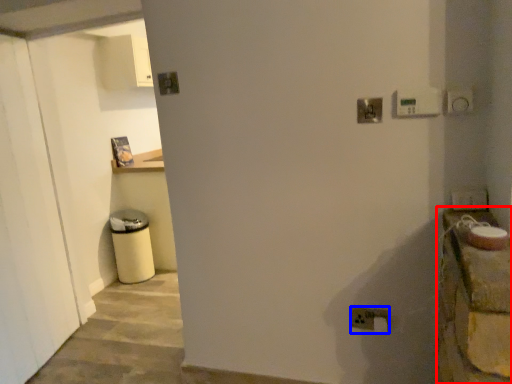
Question: Which of the following is the closest to the observer, counter top (highlighted by a red box) or electric outlet (highlighted by a blue box)?

Choices:
 (A) counter top
 (B) electric outlet

Answer: (A)